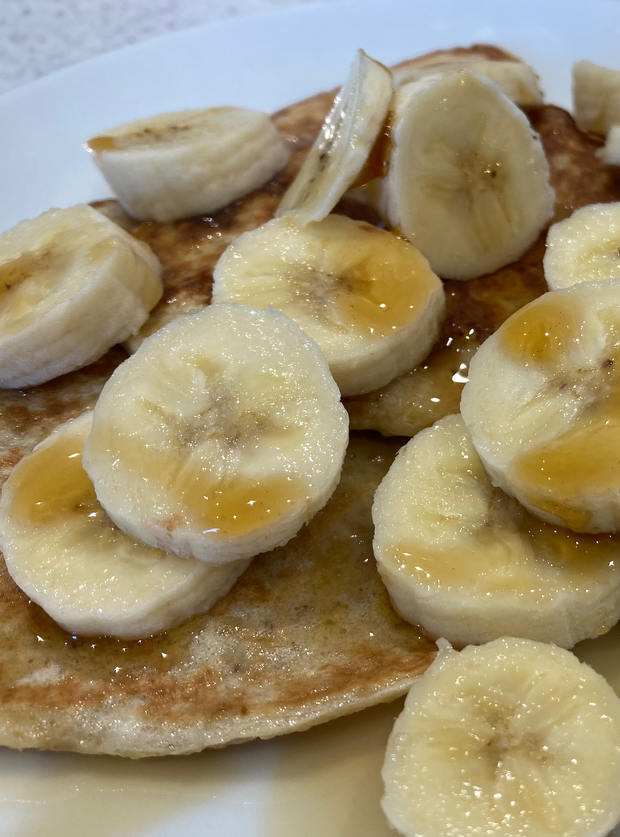
What are the coordinates of `plate in top right corner` in the screenshot? It's located at (601, 17).